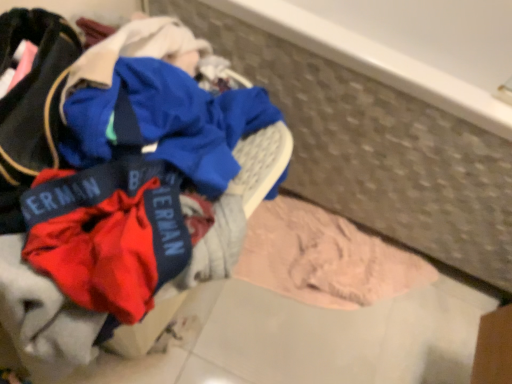
Question: Looking at the image, does red fabric laundry at center seem bigger or smaller compared to pink soft fabric at lower right?

Choices:
 (A) small
 (B) big

Answer: (B)

Question: Is point (202, 44) closer or farther from the camera than point (300, 205)?

Choices:
 (A) closer
 (B) farther

Answer: (A)

Question: Relative to pink soft fabric at lower right, is red fabric laundry at center in front or behind?

Choices:
 (A) front
 (B) behind

Answer: (A)

Question: In the image, is pink soft fabric at lower right on the left side or the right side of red fabric laundry at center?

Choices:
 (A) left
 (B) right

Answer: (B)

Question: From their relative heights in the image, would you say pink soft fabric at lower right is taller or shorter than red fabric laundry at center?

Choices:
 (A) short
 (B) tall

Answer: (A)

Question: Is point (285, 292) closer or farther from the camera than point (239, 195)?

Choices:
 (A) farther
 (B) closer

Answer: (A)

Question: Relative to red fabric laundry at center, is pink soft fabric at lower right in front or behind?

Choices:
 (A) behind
 (B) front

Answer: (A)